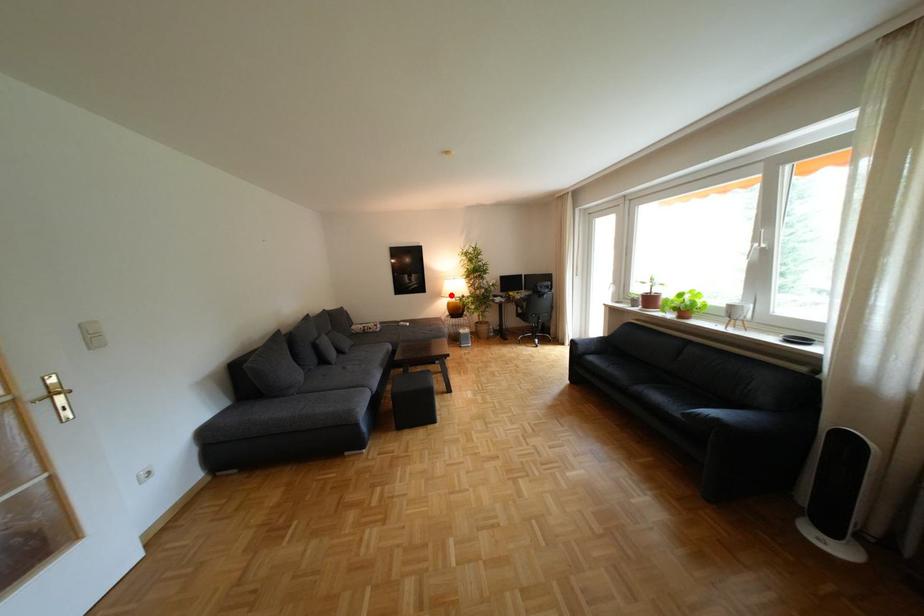
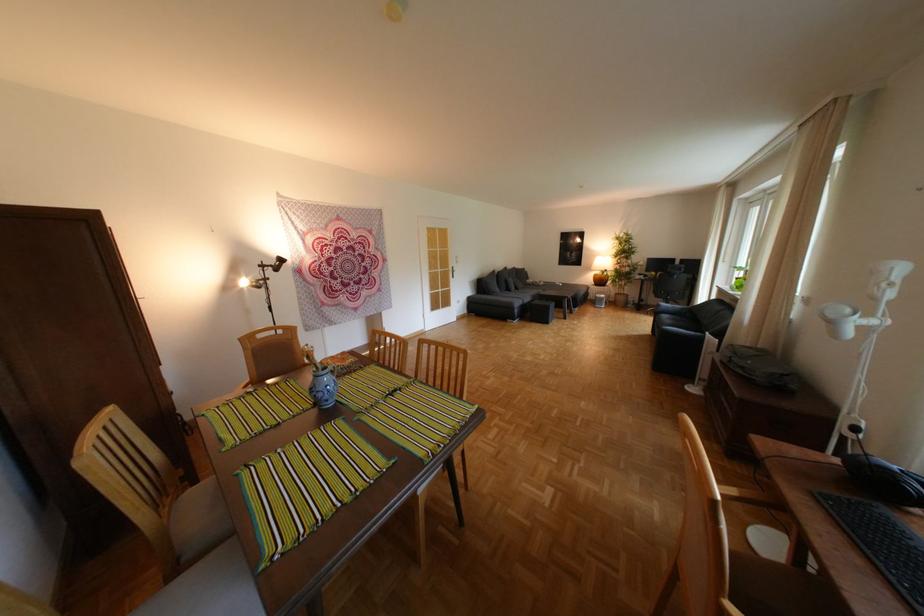
The point at the highlighted location is marked in the first image. Where is the corresponding point in the second image?

(602, 268)